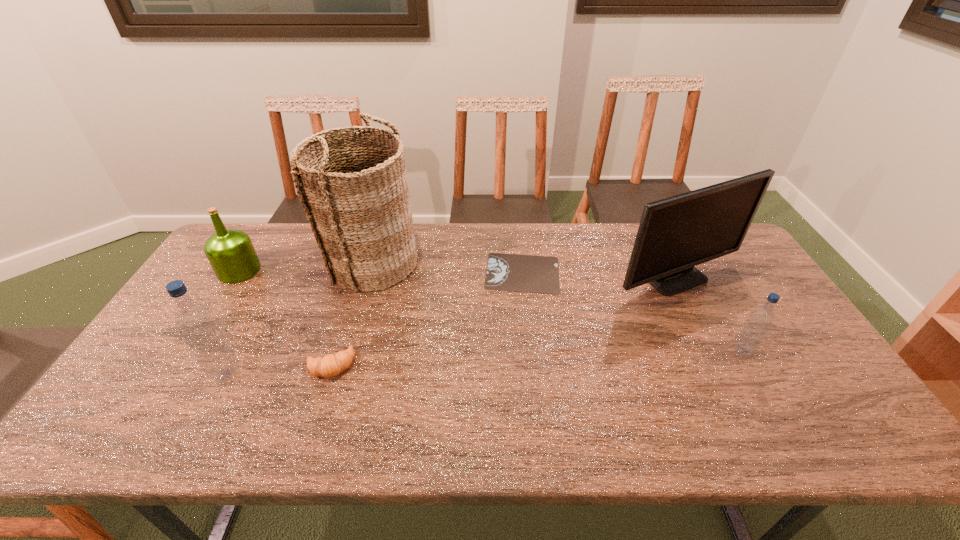
The height and width of the screenshot is (540, 960). In order to click on blank space at the right edge in this screenshot , I will do `click(781, 322)`.

Locate an element on the screen. vacant space that's between the taller water bottle and the fifth object from left to right is located at coordinates (374, 323).

Find the location of `vacant area that lies between the computer monitor and the second shortest object`. vacant area that lies between the computer monitor and the second shortest object is located at coordinates point(505,323).

The image size is (960, 540). I want to click on vacant space that's between the second object from left to right and the computer monitor, so click(x=452, y=327).

Find the location of `empty space that is in between the taller water bottle and the crescent roll`. empty space that is in between the taller water bottle and the crescent roll is located at coordinates (278, 369).

This screenshot has height=540, width=960. Find the location of `vacant space in between the mousepad and the basket`. vacant space in between the mousepad and the basket is located at coordinates (446, 267).

Find the location of a particular element. This screenshot has height=540, width=960. free area in between the farther water bottle and the computer monitor is located at coordinates (710, 316).

You are a GUI agent. You are given a task and a screenshot of the screen. Output one action in this format:
    pyautogui.click(x=<x>, y=<y>)
    Task: Click on the free space that is in between the third object from right to left and the right water bottle
    The image size is (960, 540).
    Given the screenshot: What is the action you would take?
    pyautogui.click(x=633, y=312)

At what (x,y) coordinates should I click in order to perform the action: click on vacant region between the tallest object and the farther water bottle. Please return your answer as a coordinate pair (x, y). The height and width of the screenshot is (540, 960). Looking at the image, I should click on (557, 306).

Identify the location of the sixth closest object to the tallest object. This screenshot has width=960, height=540. (760, 320).